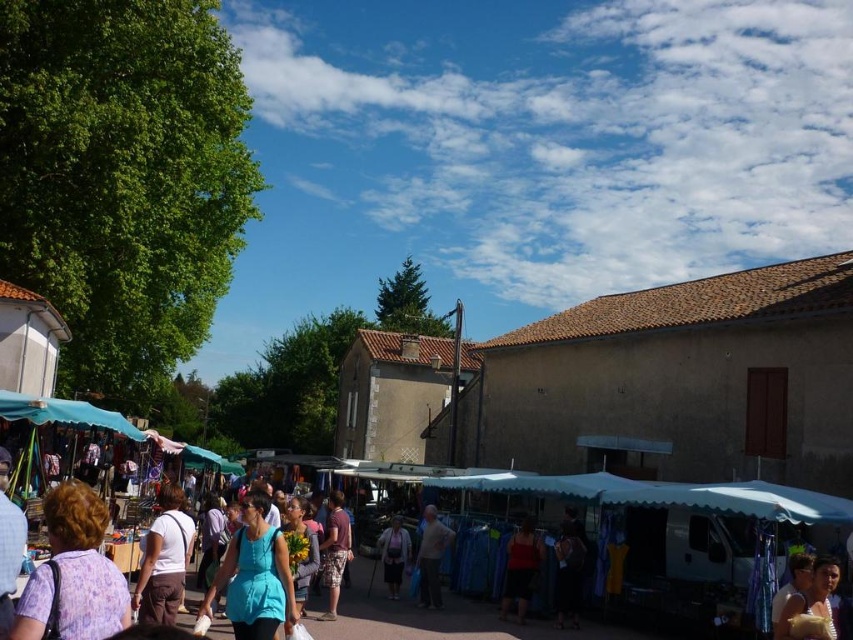
Question: Among these objects, which one is farthest from the camera?

Choices:
 (A) camouflage shorts at center
 (B) blue fabric market stall at center

Answer: (A)

Question: Which object is farther from the camera taking this photo?

Choices:
 (A) matte purple dress at center
 (B) light brown leather jacket at center
 (C) camouflage shorts at center

Answer: (A)

Question: Observing the image, what is the correct spatial positioning of white cotton shirt at center in reference to camouflage shorts at center?

Choices:
 (A) left
 (B) right

Answer: (A)

Question: Does matte blue shirt at center come behind matte red tank top at center?

Choices:
 (A) yes
 (B) no

Answer: (B)

Question: In this image, where is white cotton shirt at center located relative to matte purple dress at center?

Choices:
 (A) left
 (B) right

Answer: (A)

Question: Which of these objects is positioned farthest from the white cotton shirt at center?

Choices:
 (A) camouflage shorts at center
 (B) light brown leather jacket at center
 (C) blue fabric market stall at center
 (D) matte purple dress at center

Answer: (C)